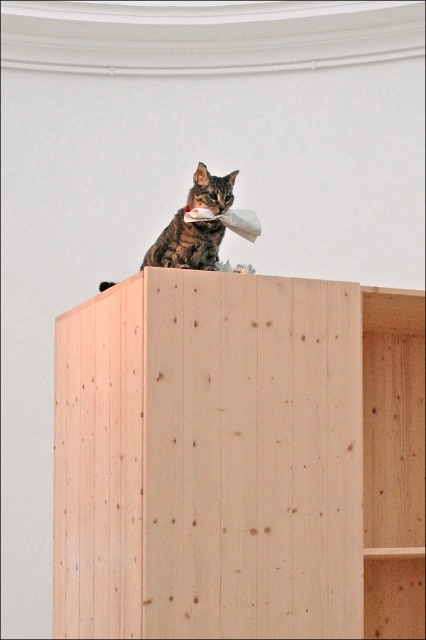
You are a photographer adjusting your camera to focus on two points in the image. The first point is point [327,547] and the second is point [180,216]. Which point should you focus on first if you want to capture the closest object to the camera?

Point [327,547] is closer to the camera than point [180,216], so you should focus on point [327,547] first to capture the closest object.

You are a delivery robot with a package that is 40 centimeters wide. You need to place it on the natural wood bookshelf at upper center where the tabby fur cat at upper center is currently sitting. Is there enough space for the package?

The distance between the natural wood bookshelf at upper center and the tabby fur cat at upper center is 38.00 centimeters. Since the package is 40 centimeters wide, it is slightly wider than the available space, so the package cannot be placed there without overlapping the cat.